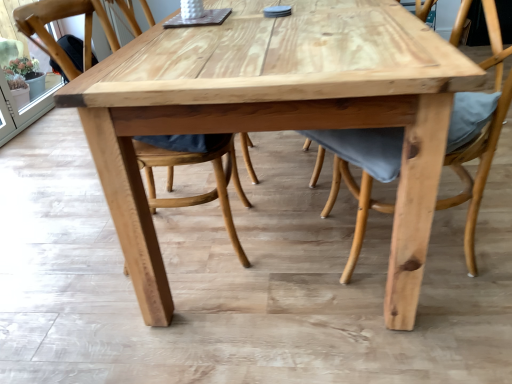
Question: Is natural wood chair at center, placed as the 2th chair when sorted from left to right, situated inside natural wood chair at center, which appears as the 2th chair when viewed from the right, or outside?

Choices:
 (A) outside
 (B) inside

Answer: (A)

Question: Is point (496, 51) closer or farther from the camera than point (65, 11)?

Choices:
 (A) farther
 (B) closer

Answer: (B)

Question: Is natural wood chair at center, placed as the 2th chair when sorted from left to right, to the left or to the right of natural wood chair at center, which appears as the 2th chair when viewed from the right, in the image?

Choices:
 (A) left
 (B) right

Answer: (B)

Question: Visually, is natural wood chair at center, the 1th chair from the left, positioned to the left or to the right of natural wood chair at center, the 1th chair positioned from the right?

Choices:
 (A) left
 (B) right

Answer: (A)

Question: Is point (46, 3) closer or farther from the camera than point (464, 195)?

Choices:
 (A) farther
 (B) closer

Answer: (B)

Question: Is natural wood chair at center, the 1th chair from the left, bigger or smaller than natural wood chair at center, the 1th chair positioned from the right?

Choices:
 (A) big
 (B) small

Answer: (B)

Question: Is natural wood chair at center, which appears as the 2th chair when viewed from the right, inside the boundaries of natural wood chair at center, placed as the 2th chair when sorted from left to right, or outside?

Choices:
 (A) outside
 (B) inside

Answer: (A)